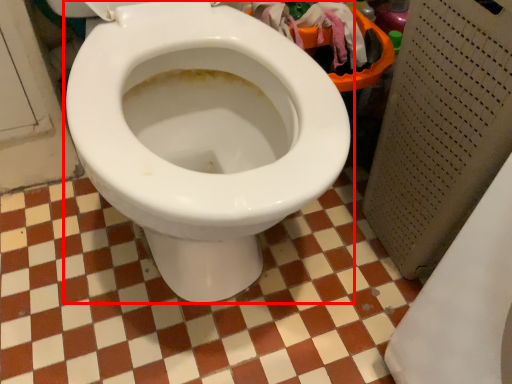
Question: From the image's perspective, what is the correct spatial relationship of toilet (annotated by the red box) in relation to ceramic tile?

Choices:
 (A) below
 (B) above

Answer: (B)